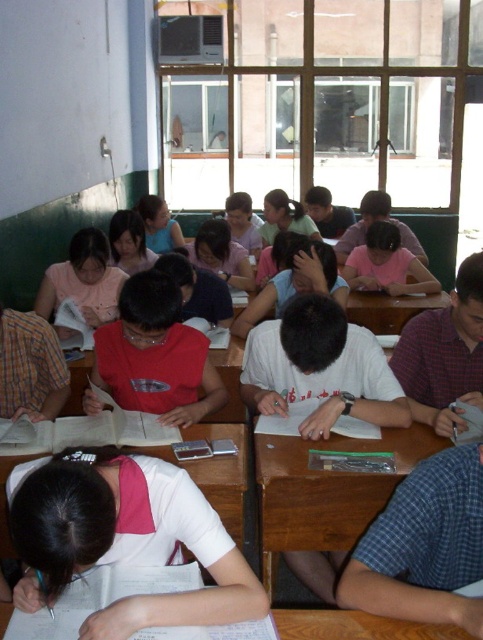
Does white matte shirt at center have a greater width compared to wooden desk at center?

Incorrect, white matte shirt at center's width does not surpass wooden desk at center's.

Does white matte shirt at center appear on the left side of wooden desk at center?

Indeed, white matte shirt at center is positioned on the left side of wooden desk at center.

At what (x,y) coordinates should I click in order to perform the action: click on white matte shirt at center. Please return your answer as a coordinate pair (x, y). The width and height of the screenshot is (483, 640). Looking at the image, I should click on (124, 538).

Image resolution: width=483 pixels, height=640 pixels. I want to click on white matte shirt at center, so click(124, 538).